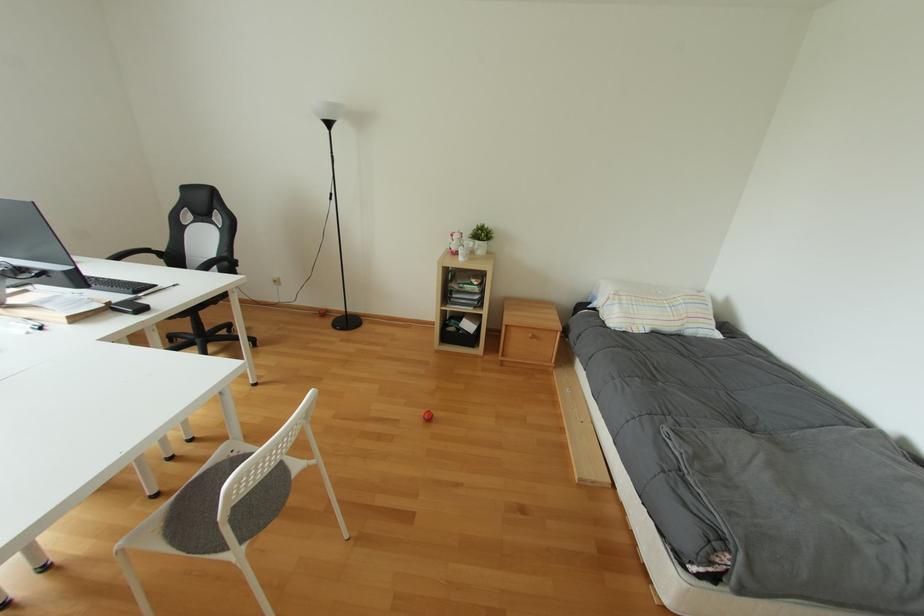
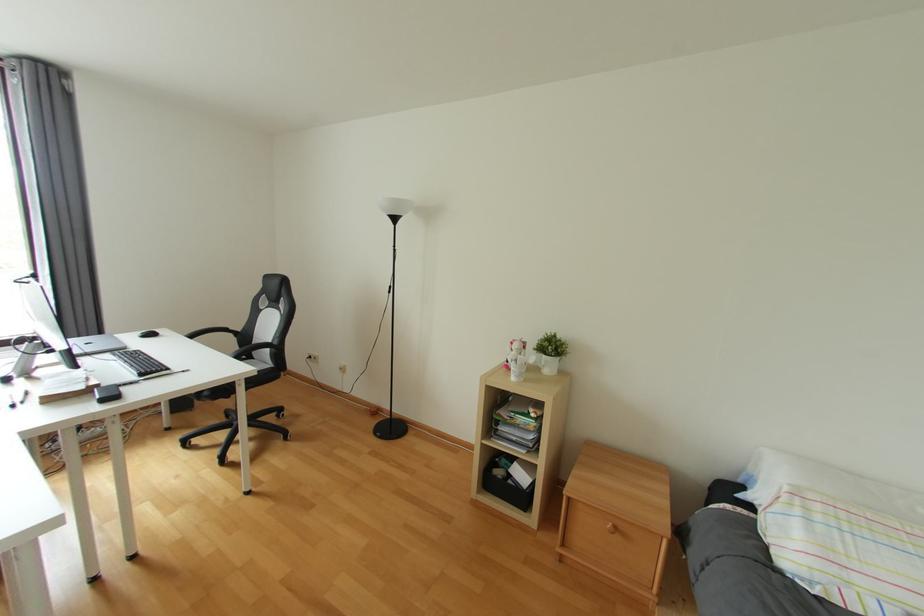
The images are taken continuously from a first-person perspective. In which direction are you moving?

The movement direction of the cameraman is right, forward.